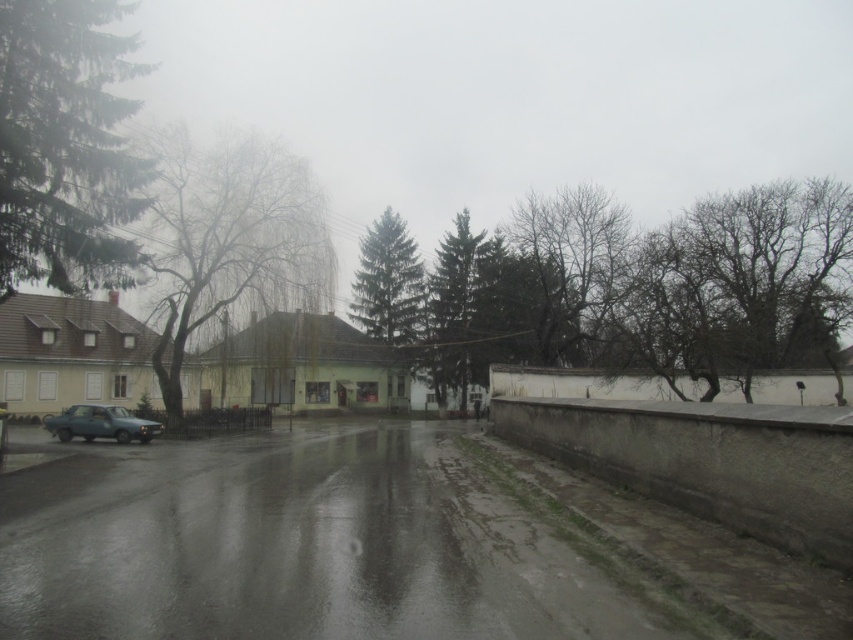
Question: Does green matte tree at left have a smaller size compared to green textured pine tree at center?

Choices:
 (A) yes
 (B) no

Answer: (A)

Question: Estimate the real-world distances between objects in this image. Which object is closer to the metallic blue car at lower left?

Choices:
 (A) green textured pine tree at center
 (B) green leafy tree at left
 (C) green leafy tree at center
 (D) green matte tree at center

Answer: (B)

Question: Can you confirm if green leafy tree at center is wider than metallic blue car at lower left?

Choices:
 (A) yes
 (B) no

Answer: (A)

Question: Is green matte tree at left positioned in front of green matte tree at center?

Choices:
 (A) no
 (B) yes

Answer: (B)

Question: Which of these objects is positioned closest to the metallic blue car at lower left?

Choices:
 (A) green matte tree at left
 (B) green textured pine tree at center

Answer: (A)

Question: Which object is farther from the camera taking this photo?

Choices:
 (A) metallic blue car at lower left
 (B) green textured pine tree at center
 (C) green leafy tree at center
 (D) green matte tree at center

Answer: (B)